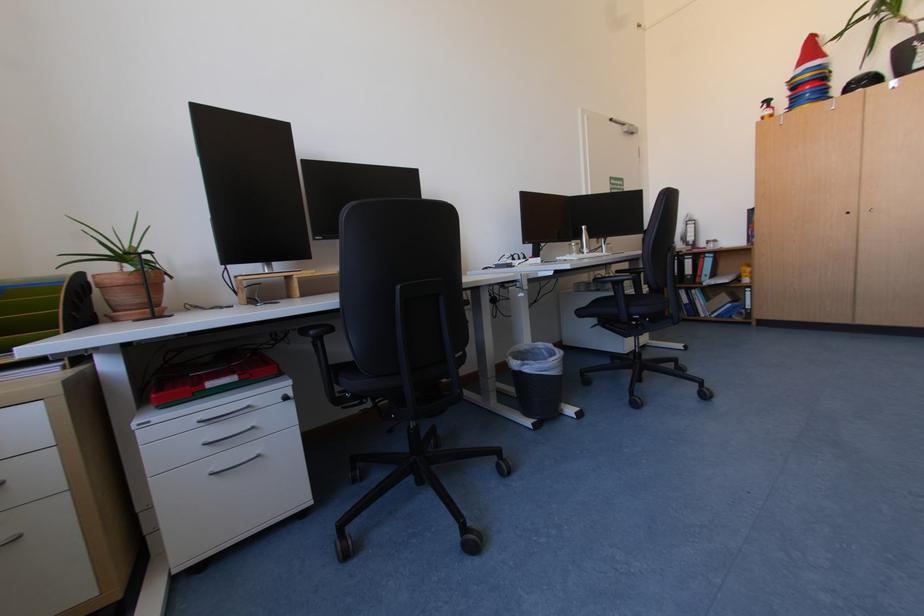
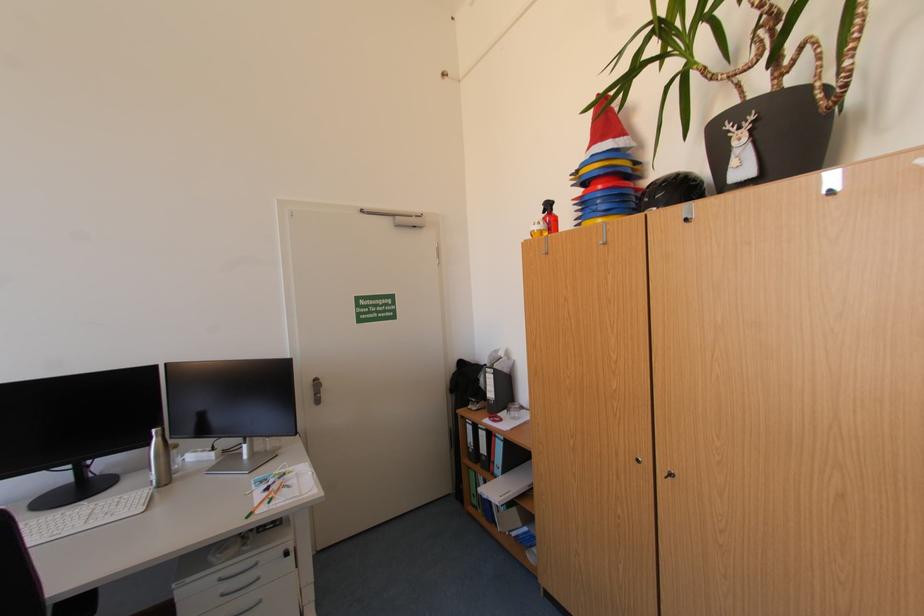
The images are taken continuously from a first-person perspective. In which direction are you moving?

The cameraman walked toward right, forward.